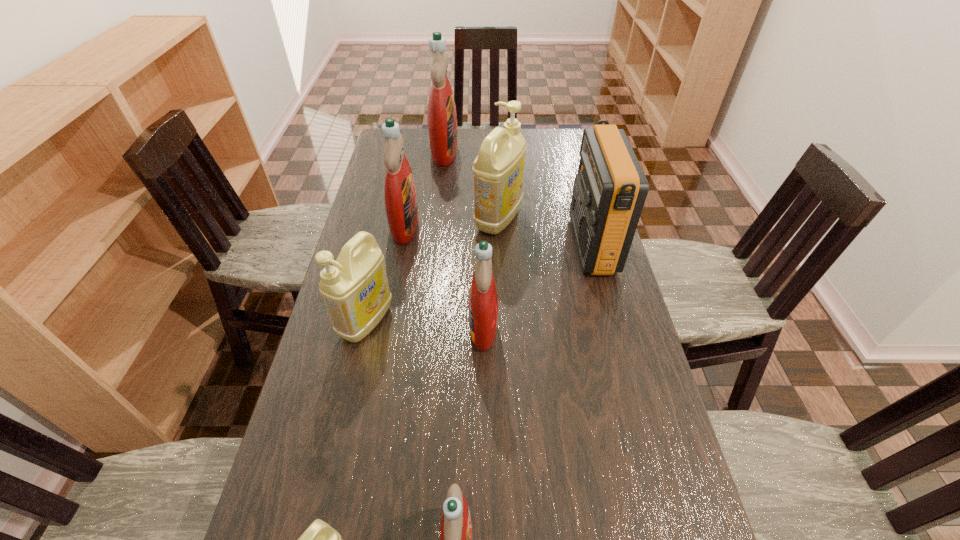
This screenshot has width=960, height=540. What are the coordinates of `detergent that can be found as the sixth closest to the second nearest red detergent` in the screenshot? It's located at (442, 120).

Identify the location of detergent identified as the fourth closest to the farthest beige detergent. (355, 289).

Find the location of `red detergent that is the second closest to the biggest red detergent`. red detergent that is the second closest to the biggest red detergent is located at coordinates (483, 301).

Choose which red detergent is the third nearest neighbor to the farthest beige detergent. Please provide its 2D coordinates. Your answer should be formatted as a tuple, i.e. [(x, y)], where the tuple contains the x and y coordinates of a point satisfying the conditions above.

[(483, 301)]

Select which beige detergent appears as the third closest to the smallest red detergent. Please provide its 2D coordinates. Your answer should be formatted as a tuple, i.e. [(x, y)], where the tuple contains the x and y coordinates of a point satisfying the conditions above.

[(498, 171)]

Locate which beige detergent is the second closest to the farthest beige detergent. Please provide its 2D coordinates. Your answer should be formatted as a tuple, i.e. [(x, y)], where the tuple contains the x and y coordinates of a point satisfying the conditions above.

[(319, 539)]